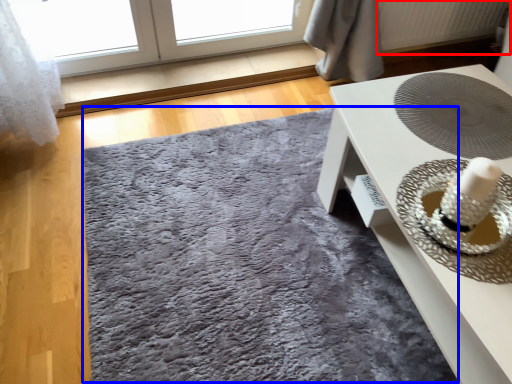
Question: Which of the following is the closest to the observer, radiator (highlighted by a red box) or mat (highlighted by a blue box)?

Choices:
 (A) radiator
 (B) mat

Answer: (B)